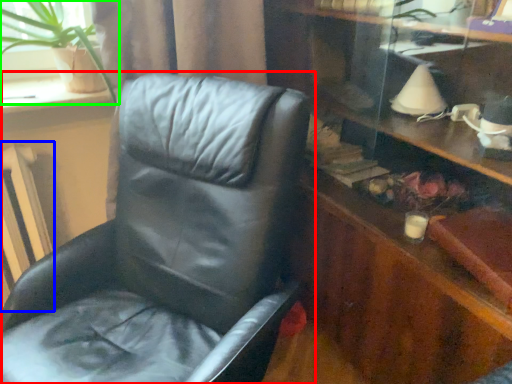
Question: Estimate the real-world distances between objects in this image. Which object is closer to chair (highlighted by a red box), radiator (highlighted by a blue box) or houseplant (highlighted by a green box)?

Choices:
 (A) radiator
 (B) houseplant

Answer: (B)